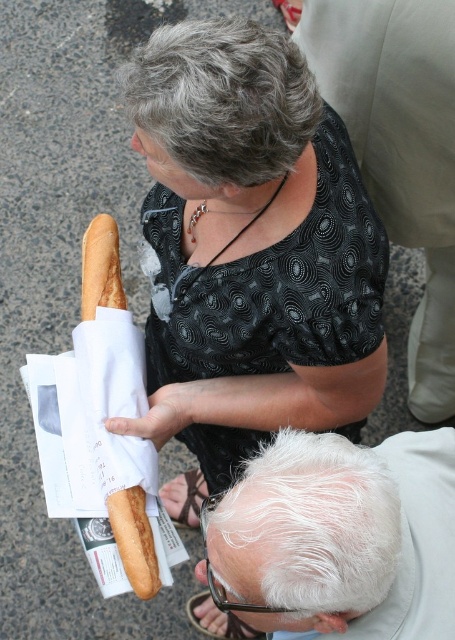
You are a photographer trying to capture a candid shot of the white hair at lower center and the golden brown bread at left. Since you want to focus on the bread, should you adjust your camera to focus on the object that is closer to you?

The white hair at lower center is positioned under golden brown bread at left, which means the bread is closer to you. Therefore, you should focus on the golden brown bread at left as it is nearer to your camera.

You are a photographer trying to capture a candid shot of the matte black blouse at upper center and the golden brown bread at left. Since you want to focus on the blouse, which object should you adjust your camera focus to prioritize?

The matte black blouse at upper center is closer to the viewer than the golden brown bread at left, so you should adjust your camera focus to prioritize the matte black blouse at upper center to ensure it is in sharp focus.

You are a photographer trying to capture both the matte black blouse at upper center and the golden brown bread at left in a single frame. Given their sizes, which object should you focus on to ensure both fit clearly in the photo?

Since the matte black blouse at upper center is larger than the golden brown bread at left, you should focus on the matte black blouse at upper center to ensure both objects fit clearly in the photo.